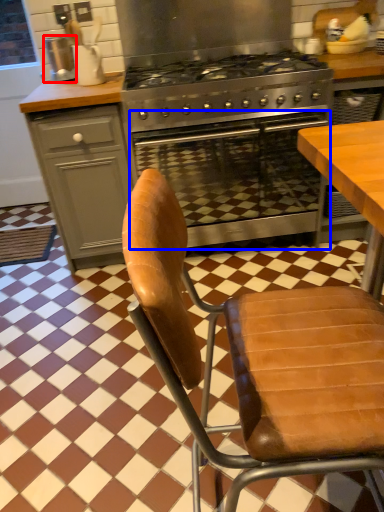
Question: Which of the following is the farthest to the observer, appliance (highlighted by a red box) or oven (highlighted by a blue box)?

Choices:
 (A) appliance
 (B) oven

Answer: (A)